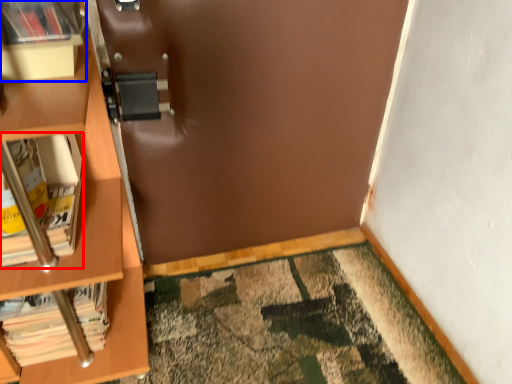
Question: Among these objects, which one is farthest to the camera, book (highlighted by a red box) or shelf (highlighted by a blue box)?

Choices:
 (A) book
 (B) shelf

Answer: (A)